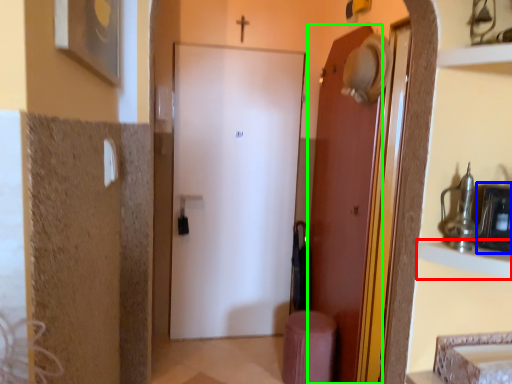
Question: Estimate the real-world distances between objects in this image. Which object is farther from cabinet (highlighted by a red box), medicine cabinet (highlighted by a blue box) or door (highlighted by a green box)?

Choices:
 (A) medicine cabinet
 (B) door

Answer: (B)